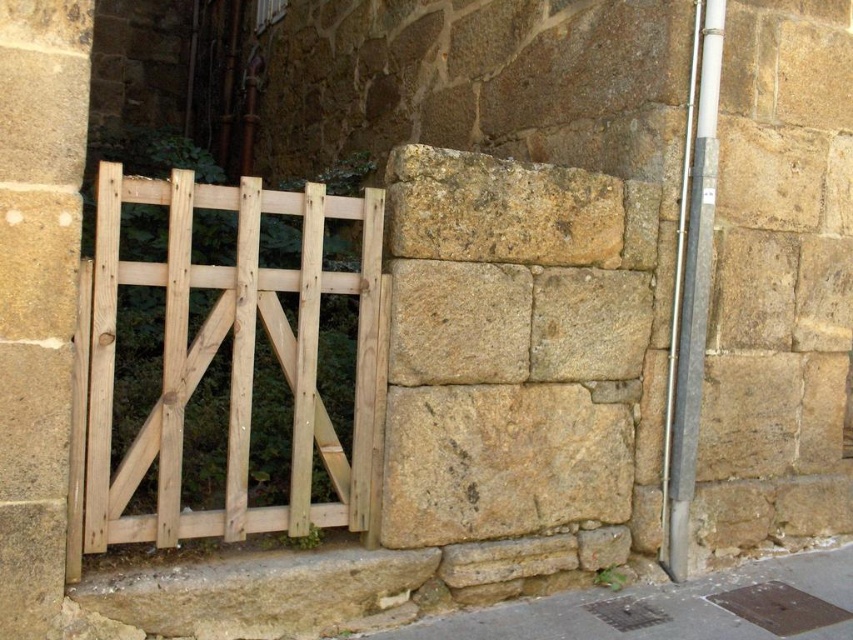
You are standing in front of a rustic scene with a natural wood gate at left and a brown stone wall at lower right. Which object is positioned to the left side of the other?

The natural wood gate at left is to the left of brown stone wall at lower right.

You are standing in front of the wooden gate leaning against a stone wall. You need to locate the natural wood gate at left. Where exactly is it positioned in terms of coordinates?

The natural wood gate at left is positioned at the 2D coordinates of point (230, 365).